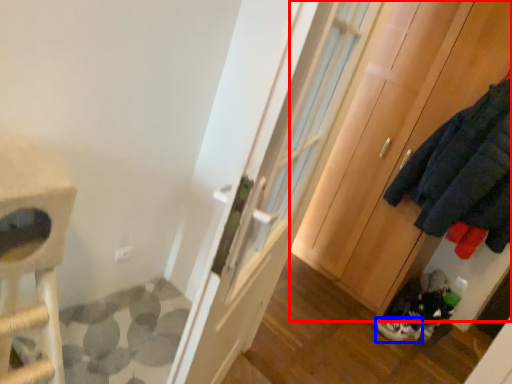
Question: Which object appears farthest to the camera in this image, cabinetry (highlighted by a red box) or footwear (highlighted by a blue box)?

Choices:
 (A) cabinetry
 (B) footwear

Answer: (B)